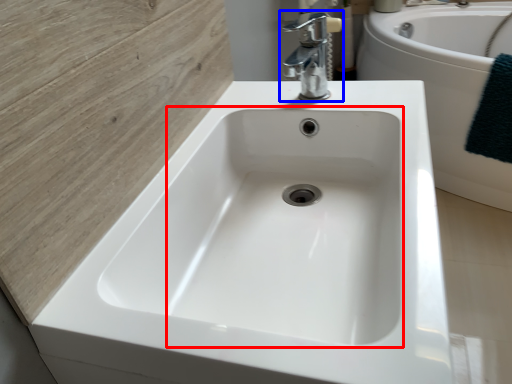
Question: Which of the following is the closest to the observer, sink (highlighted by a red box) or tap (highlighted by a blue box)?

Choices:
 (A) sink
 (B) tap

Answer: (A)